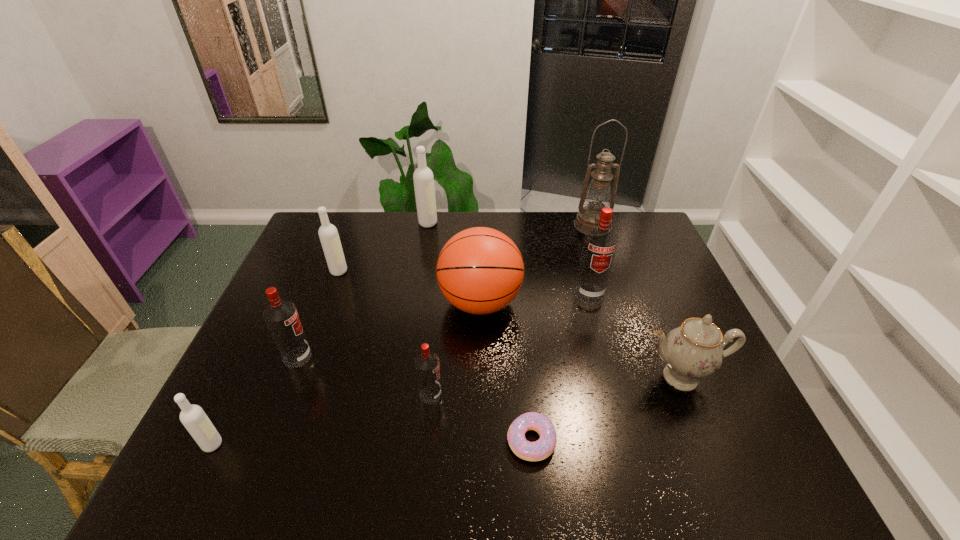
I want to click on oil lamp, so click(598, 195).

Find the location of a particular element. the fourth vodka from left to right is located at coordinates (423, 178).

Identify the location of the rightmost white vodka. (423, 178).

I want to click on the rightmost vodka, so point(600,242).

I want to click on the rightmost red vodka, so click(600, 242).

Find the location of `basketball`. basketball is located at coordinates (480, 270).

I want to click on the second biggest white vodka, so click(328, 234).

This screenshot has width=960, height=540. What are the coordinates of `the second farthest white vodka` in the screenshot? It's located at (328, 234).

Image resolution: width=960 pixels, height=540 pixels. I want to click on the second smallest red vodka, so click(x=281, y=317).

At what (x,y) coordinates should I click in order to perform the action: click on the second farthest red vodka. Please return your answer as a coordinate pair (x, y). This screenshot has width=960, height=540. Looking at the image, I should click on (281, 317).